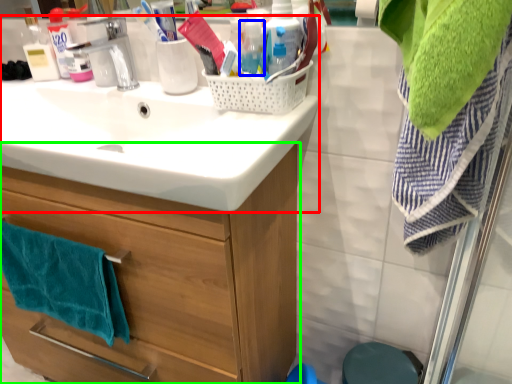
Question: Based on their relative distances, which object is nearer to sink (highlighted by a red box)? Choose from bottle (highlighted by a blue box) and bathroom cabinet (highlighted by a green box).

Choices:
 (A) bottle
 (B) bathroom cabinet

Answer: (B)